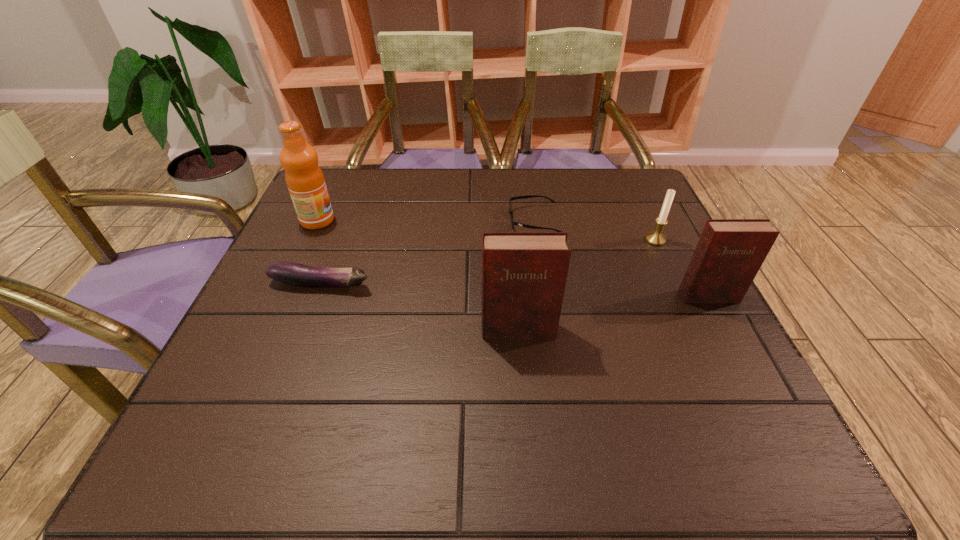
Locate an element on the screen. The height and width of the screenshot is (540, 960). free space in the image that satisfies the following two spatial constraints: 1. on the label side of the fifth tallest object; 2. on the right side of the fruit juice is located at coordinates (288, 284).

This screenshot has width=960, height=540. In order to click on free space that satisfies the following two spatial constraints: 1. on the label side of the fruit juice; 2. on the right side of the fourth tallest object in this screenshot , I will do `click(308, 240)`.

Find the location of a particular element. The width and height of the screenshot is (960, 540). free point that satisfies the following two spatial constraints: 1. on the front-facing side of the shortest object; 2. on the front side of the eggplant is located at coordinates (542, 284).

Image resolution: width=960 pixels, height=540 pixels. Find the location of `free space that satisfies the following two spatial constraints: 1. on the front-facing side of the fourth tallest object; 2. on the right side of the shortest object`. free space that satisfies the following two spatial constraints: 1. on the front-facing side of the fourth tallest object; 2. on the right side of the shortest object is located at coordinates (536, 240).